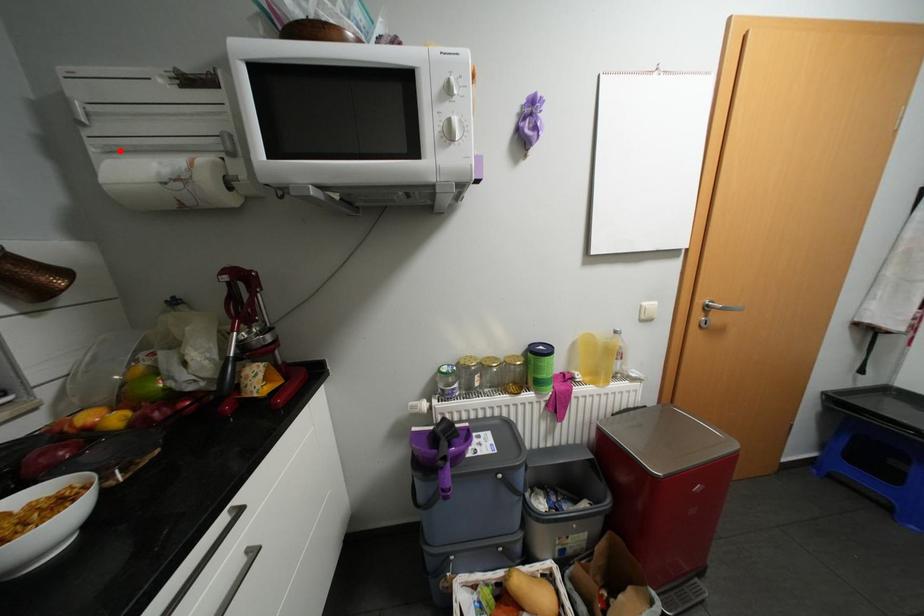
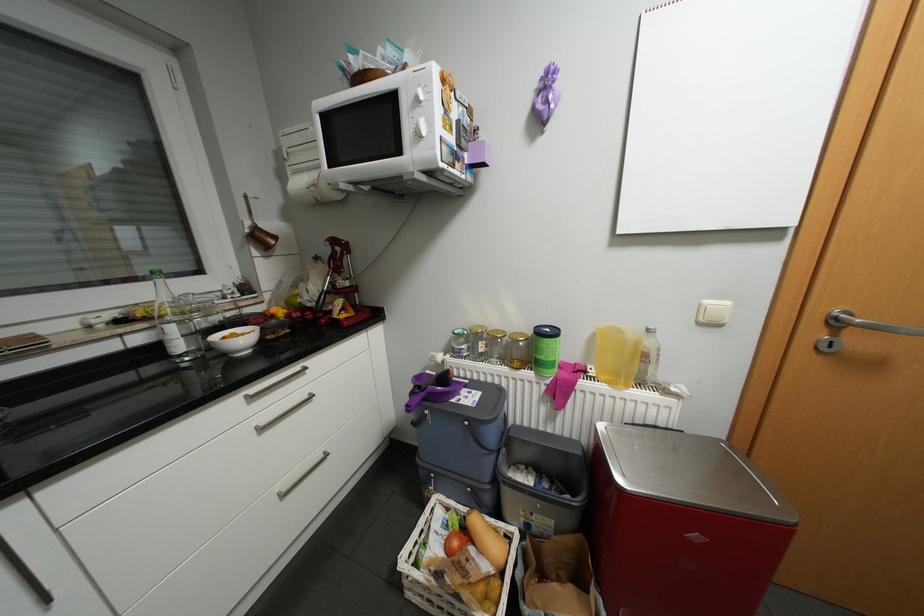
Question: I am providing you with two images of the same scene from different viewpoints. A red point is shown in image1. For the corresponding object point in image2, is it positioned nearer or farther from the camera?

Choices:
 (A) Nearer
 (B) Farther

Answer: (A)